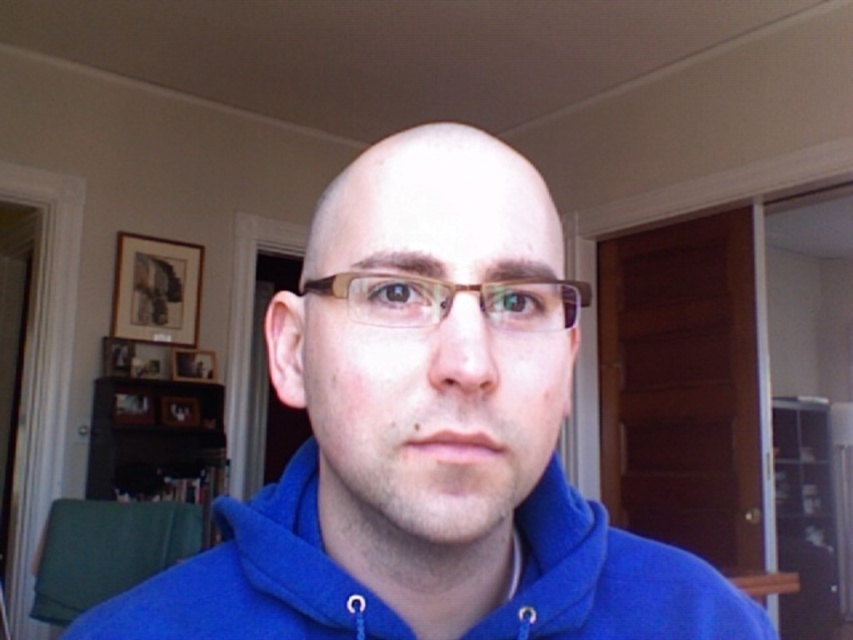
Question: Is blue matte hoodie at center to the right of brown translucent glasses at center from the viewer's perspective?

Choices:
 (A) yes
 (B) no

Answer: (B)

Question: Can you confirm if blue matte hoodie at center is bigger than brown translucent glasses at center?

Choices:
 (A) yes
 (B) no

Answer: (A)

Question: Which object is closer to the camera taking this photo?

Choices:
 (A) brown translucent glasses at center
 (B) blue fleece jacket at center

Answer: (A)

Question: Is blue fleece jacket at center positioned at the back of brown translucent glasses at center?

Choices:
 (A) yes
 (B) no

Answer: (A)

Question: Which of the following is the farthest from the observer?

Choices:
 (A) blue fleece jacket at center
 (B) blue matte hoodie at center

Answer: (A)

Question: Which point is closer to the camera?

Choices:
 (A) brown translucent glasses at center
 (B) blue matte hoodie at center

Answer: (B)